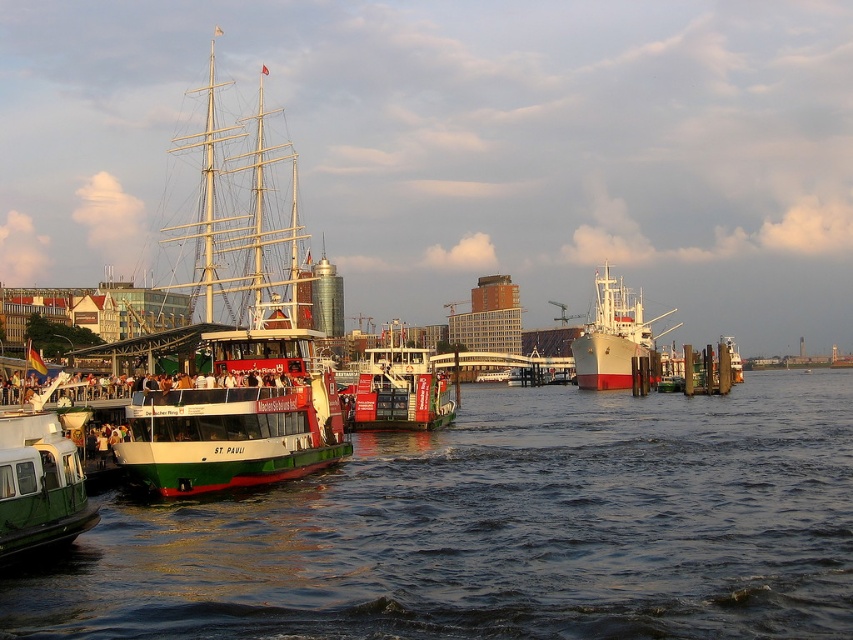
You are a crane operator at the harbor and need to move a container from the green matte ship at left to the green matte barge at lower left. Considering their heights, will the container be able to pass under the overhead power lines that are 10 meters above the barge?

The green matte ship at left is much taller than the green matte barge at lower left. Since the power lines are 10 meters above the barge, the container from the taller ship might exceed the height limit and could hit the power lines. Check the exact height difference before proceeding.

You are standing on the pier and want to board the red painted ferry at center. There is a green matte barge at lower left blocking your path. Can you walk around it to reach the ferry?

The green matte barge at lower left is closer to the viewer than the red painted ferry at center, so you can walk around it to reach the ferry.